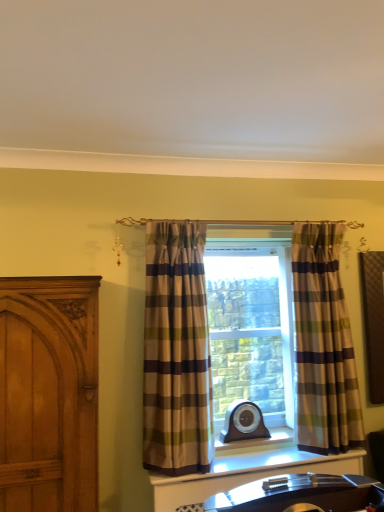
Question: Is plaid fabric curtain at center, the second curtain from the right, bigger than wooden carved door at left?

Choices:
 (A) no
 (B) yes

Answer: (A)

Question: Can we say plaid fabric curtain at center, the second curtain from the right, lies outside wooden carved door at left?

Choices:
 (A) no
 (B) yes

Answer: (B)

Question: Is plaid fabric curtain at center, the second curtain from the right, taller than wooden carved door at left?

Choices:
 (A) no
 (B) yes

Answer: (B)

Question: Is plaid fabric curtain at center, the first curtain positioned from the left, to the left of wooden carved door at left from the viewer's perspective?

Choices:
 (A) yes
 (B) no

Answer: (B)

Question: From a real-world perspective, is plaid fabric curtain at center, the second curtain from the right, over wooden carved door at left?

Choices:
 (A) no
 (B) yes

Answer: (B)

Question: Based on their positions, is wooden carved door at left located to the left or right of plaid fabric curtain at center, placed as the 2th curtain when sorted from left to right?

Choices:
 (A) right
 (B) left

Answer: (B)

Question: Does point (69, 407) appear closer or farther from the camera than point (312, 268)?

Choices:
 (A) closer
 (B) farther

Answer: (A)

Question: Considering their positions, is wooden carved door at left located in front of or behind plaid fabric curtain at center, which ranks as the first curtain in right-to-left order?

Choices:
 (A) behind
 (B) front

Answer: (B)

Question: In terms of size, does wooden carved door at left appear bigger or smaller than plaid fabric curtain at center, which ranks as the first curtain in right-to-left order?

Choices:
 (A) big
 (B) small

Answer: (A)

Question: Do you think plaid fabric curtain at center, which ranks as the first curtain in right-to-left order, is within wooden carved door at left, or outside of it?

Choices:
 (A) outside
 (B) inside

Answer: (A)

Question: Is plaid fabric curtain at center, placed as the 2th curtain when sorted from left to right, to the left or to the right of wooden carved door at left in the image?

Choices:
 (A) left
 (B) right

Answer: (B)

Question: From the image's perspective, is plaid fabric curtain at center, placed as the 2th curtain when sorted from left to right, positioned above or below wooden carved door at left?

Choices:
 (A) below
 (B) above

Answer: (B)

Question: Is plaid fabric curtain at center, which ranks as the first curtain in right-to-left order, taller or shorter than wooden carved door at left?

Choices:
 (A) short
 (B) tall

Answer: (B)

Question: From a real-world perspective, is plaid fabric curtain at center, the second curtain from the right, physically located above or below wooden carved door at left?

Choices:
 (A) above
 (B) below

Answer: (A)

Question: In terms of height, does plaid fabric curtain at center, the second curtain from the right, look taller or shorter compared to wooden carved door at left?

Choices:
 (A) short
 (B) tall

Answer: (B)